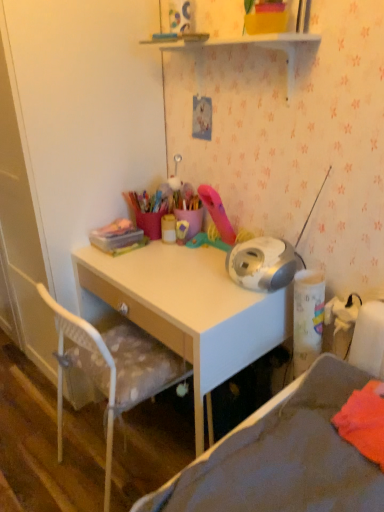
Where is `vacant space in front of translucent plastic container at upper left, which appears as the 2th stationery when viewed from the right`? vacant space in front of translucent plastic container at upper left, which appears as the 2th stationery when viewed from the right is located at coordinates (124, 261).